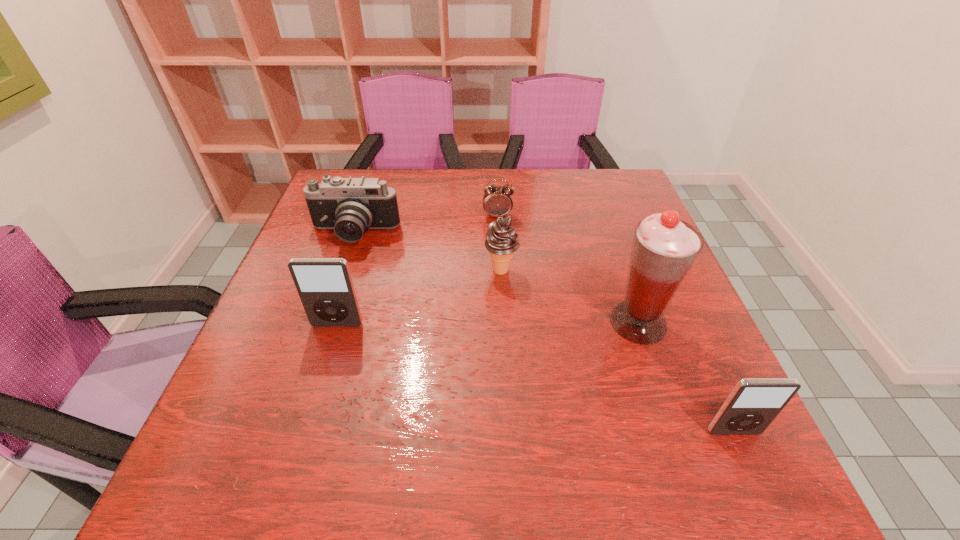
To achieve even spacing by inserting another iPod among them, please point to a vacant spot for this new iPod. Please provide its 2D coordinates. Your answer should be formatted as a tuple, i.e. [(x, y)], where the tuple contains the x and y coordinates of a point satisfying the conditions above.

[(515, 373)]